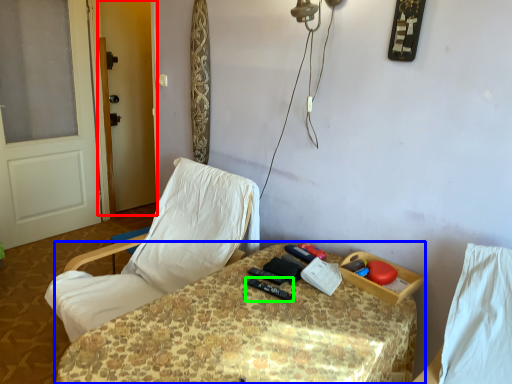
Question: Which object is positioned farthest from screen door (highlighted by a red box)? Select from table (highlighted by a blue box) and equipment (highlighted by a green box).

Choices:
 (A) table
 (B) equipment

Answer: (B)